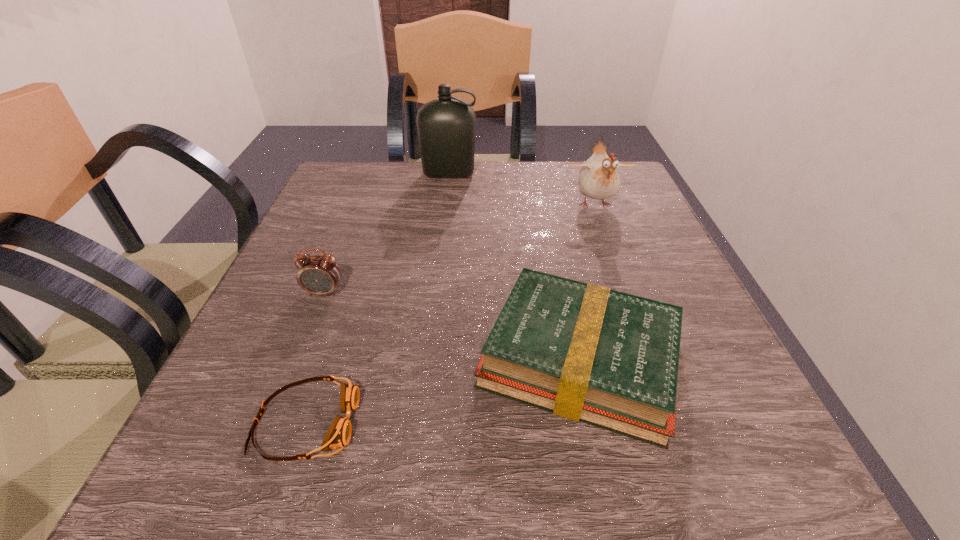
Where is `object that stands as the fourth closest to the second shortest object`? This screenshot has height=540, width=960. object that stands as the fourth closest to the second shortest object is located at coordinates (446, 126).

Where is `free point that satisfies the following two spatial constraints: 1. at the beak of the second tallest object; 2. with the lenses facing forward on the goggles`? Image resolution: width=960 pixels, height=540 pixels. free point that satisfies the following two spatial constraints: 1. at the beak of the second tallest object; 2. with the lenses facing forward on the goggles is located at coordinates (675, 423).

You are a GUI agent. You are given a task and a screenshot of the screen. Output one action in this format:
    pyautogui.click(x=<x>, y=<y>)
    Task: Click on the free space that satisfies the following two spatial constraints: 1. on the face of the alarm clock; 2. on the right side of the hardback book
    The image size is (960, 540).
    Given the screenshot: What is the action you would take?
    pyautogui.click(x=299, y=360)

Identify the location of vacant space that satisfies the following two spatial constraints: 1. on the face of the hardback book; 2. on the right side of the third tallest object. (299, 360).